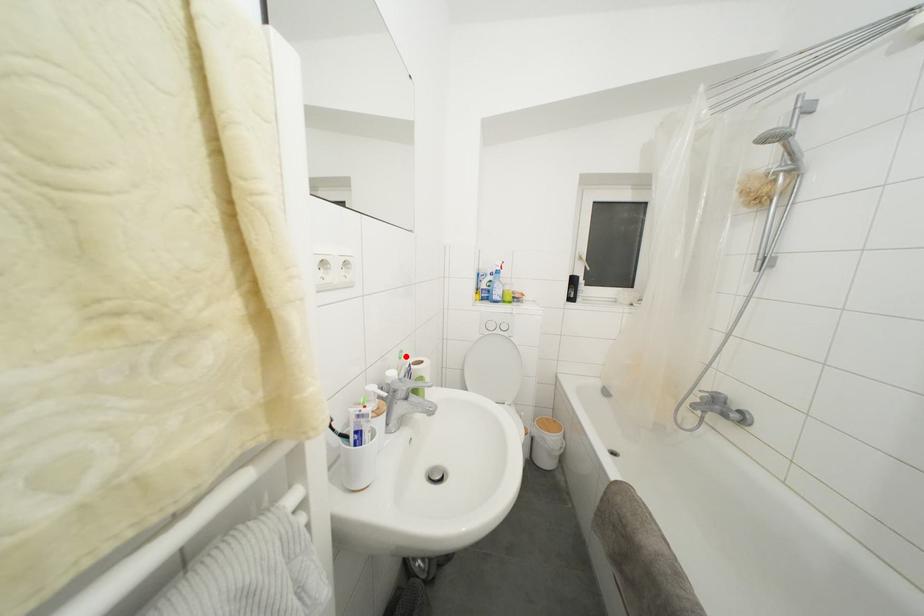
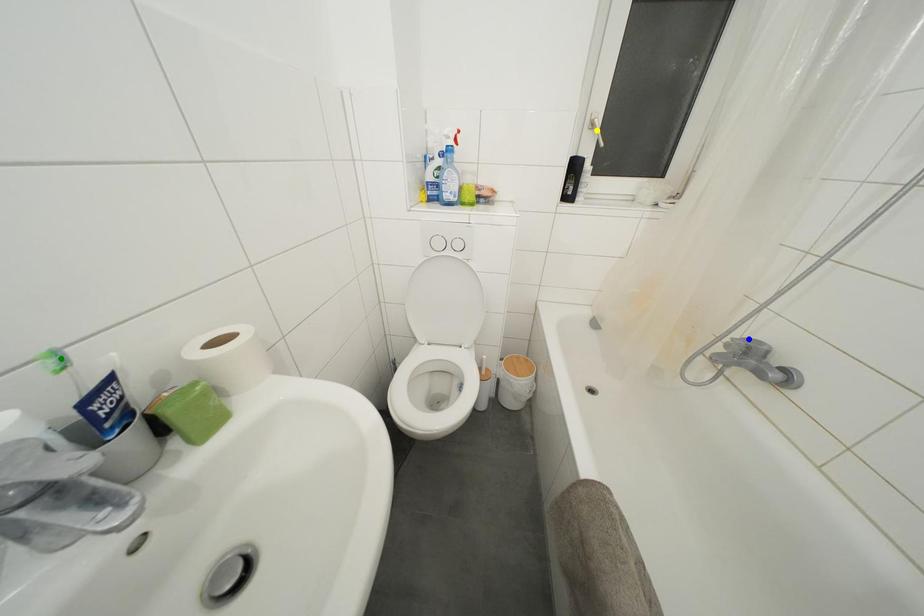
Question: I am providing you with two images of the same scene from different viewpoints. A red point is marked on the first image. You are given multiple points on the second image. Which point in image 2 is actually the same real-world point as the red point in image 1?

Choices:
 (A) yellow point
 (B) green point
 (C) blue point

Answer: (B)